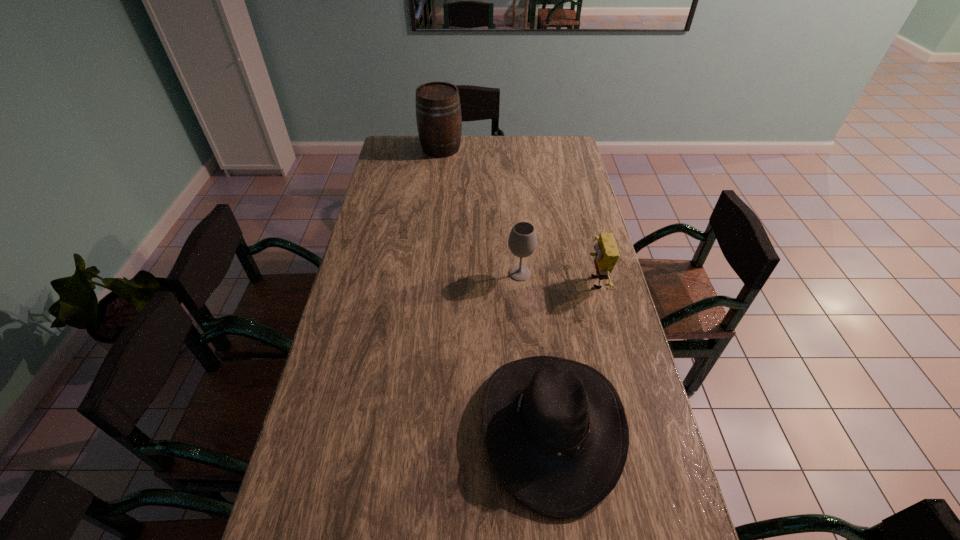
The height and width of the screenshot is (540, 960). Identify the location of the farthest object. (438, 110).

The height and width of the screenshot is (540, 960). What are the coordinates of `the tallest object` in the screenshot? It's located at (438, 110).

Locate an element on the screen. The height and width of the screenshot is (540, 960). wineglass is located at coordinates (522, 241).

You are a GUI agent. You are given a task and a screenshot of the screen. Output one action in this format:
    pyautogui.click(x=<x>, y=<y>)
    Task: Click on the sponge
    This screenshot has width=960, height=540.
    Given the screenshot: What is the action you would take?
    pyautogui.click(x=606, y=256)

Find the location of a particular element. This screenshot has height=540, width=960. cowboy hat is located at coordinates (556, 431).

The width and height of the screenshot is (960, 540). In order to click on free point located 0.270m on the side of the cider near the bung hole in this screenshot , I will do `click(436, 194)`.

Find the location of a particular element. free space located on the right of the wineglass is located at coordinates coord(563,273).

Where is `free location located 0.260m on the face of the sponge`? free location located 0.260m on the face of the sponge is located at coordinates (506, 282).

Identify the location of free spot located on the face of the sponge. The height and width of the screenshot is (540, 960). (470, 282).

Where is `vacant space located on the face of the sponge`? vacant space located on the face of the sponge is located at coordinates (533, 282).